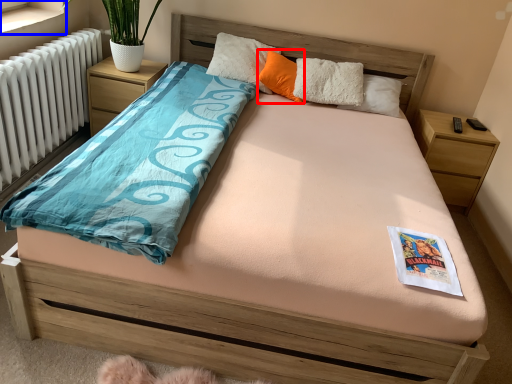
Question: Which object is closer to the camera taking this photo, pillow (highlighted by a red box) or window sill (highlighted by a blue box)?

Choices:
 (A) pillow
 (B) window sill

Answer: (B)